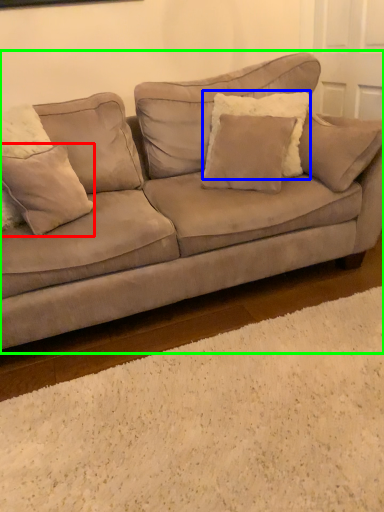
Question: Which is nearer to the pillow (highlighted by a red box)? pillow (highlighted by a blue box) or studio couch (highlighted by a green box).

Choices:
 (A) pillow
 (B) studio couch

Answer: (B)